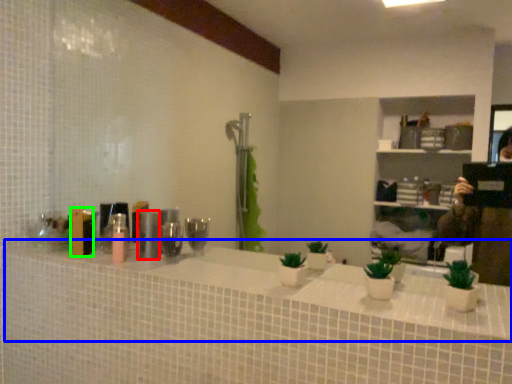
Question: Based on their relative distances, which object is nearer to toiletry (highlighted by a red box)? Choose from counter top (highlighted by a blue box) and toiletry (highlighted by a green box).

Choices:
 (A) counter top
 (B) toiletry

Answer: (B)